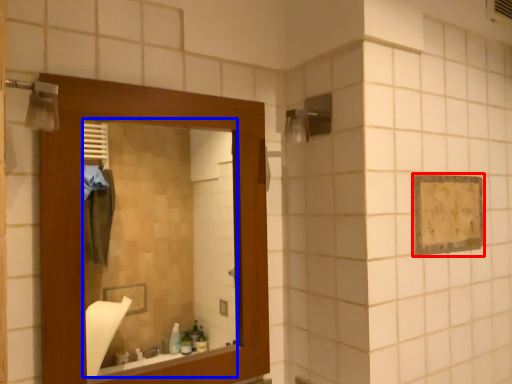
Question: Which of the following is the farthest to the observer, square (highlighted by a red box) or mirror (highlighted by a blue box)?

Choices:
 (A) square
 (B) mirror

Answer: (A)